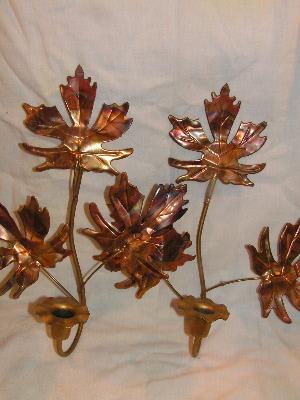
I want to click on crinkle in bed, so click(29, 84), click(14, 122), click(11, 171), click(153, 103), click(154, 129), click(173, 375), click(161, 360), click(161, 353), click(161, 341).